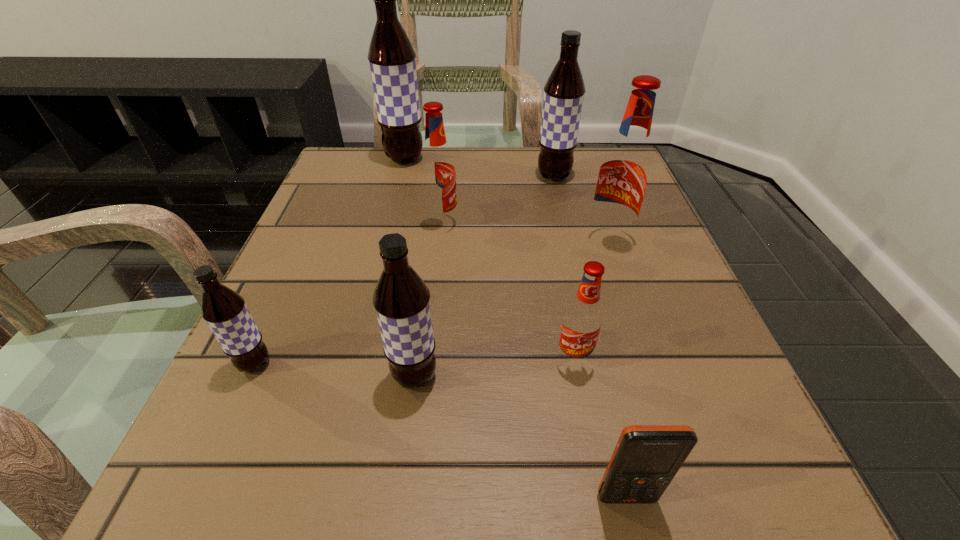
Locate an element on the screen. The image size is (960, 540). empty space that is in between the third biggest brown root beer and the shortest object is located at coordinates (520, 436).

Where is `free space that is in between the smallest red root beer and the second biggest brown root beer`? free space that is in between the smallest red root beer and the second biggest brown root beer is located at coordinates (564, 268).

Where is `vacant region between the cellular telephone and the third biggest brown root beer`? vacant region between the cellular telephone and the third biggest brown root beer is located at coordinates (520, 436).

Identify the location of empty space that is in between the second smallest brown root beer and the nearest object. The height and width of the screenshot is (540, 960). (520, 436).

You are a GUI agent. You are given a task and a screenshot of the screen. Output one action in this format:
    pyautogui.click(x=<x>, y=<y>)
    Task: Click on the vacant area between the orange cellular telephone and the third brown root beer from right to left
    
    Given the screenshot: What is the action you would take?
    pyautogui.click(x=516, y=328)

The height and width of the screenshot is (540, 960). I want to click on unoccupied position between the second smallest red root beer and the biggest red root beer, so click(525, 232).

Image resolution: width=960 pixels, height=540 pixels. I want to click on vacant region between the second brown root beer from left to right and the biggest red root beer, so click(506, 200).

Image resolution: width=960 pixels, height=540 pixels. Identify the location of vacant space in between the biggest red root beer and the leftmost red root beer. (525, 232).

Image resolution: width=960 pixels, height=540 pixels. Identify the location of vacant space that is in between the rightmost brown root beer and the nearest red root beer. click(x=564, y=268).

Locate an element on the screen. object that is the sixth closest to the leftmost red root beer is located at coordinates (224, 310).